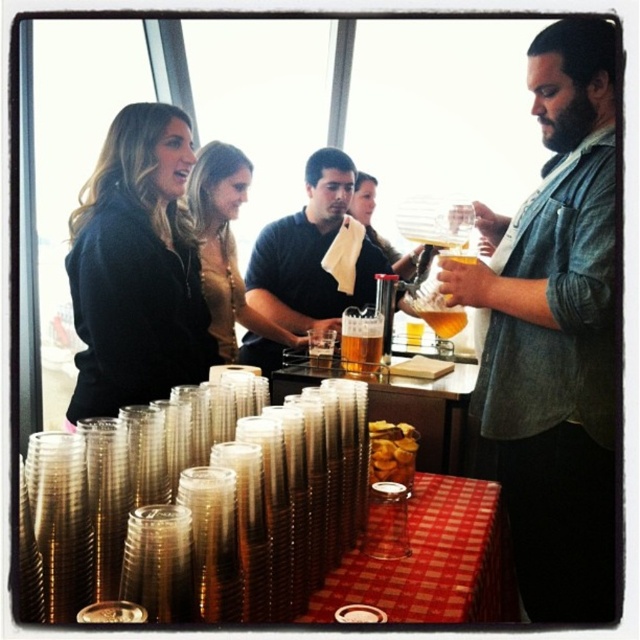
You are a guest at the beer tasting event. You see the denim shirt at right and the translucent glass carafe at center. Which object is closer to the floor?

The denim shirt at right is closer to the floor because it is below the translucent glass carafe at center.

You are a guest at the event and want to grab a drink. There is a black sweater at upper left and a translucent plastic cup at center. Which object is closer to you?

The black sweater at upper left is taller than the translucent plastic cup at center, so it is closer to you.

You are a guest at the event and want to grab a drink. Which object is taller, the denim shirt at right or the translucent glass carafe at center?

The denim shirt at right is much taller than the translucent glass carafe at center.